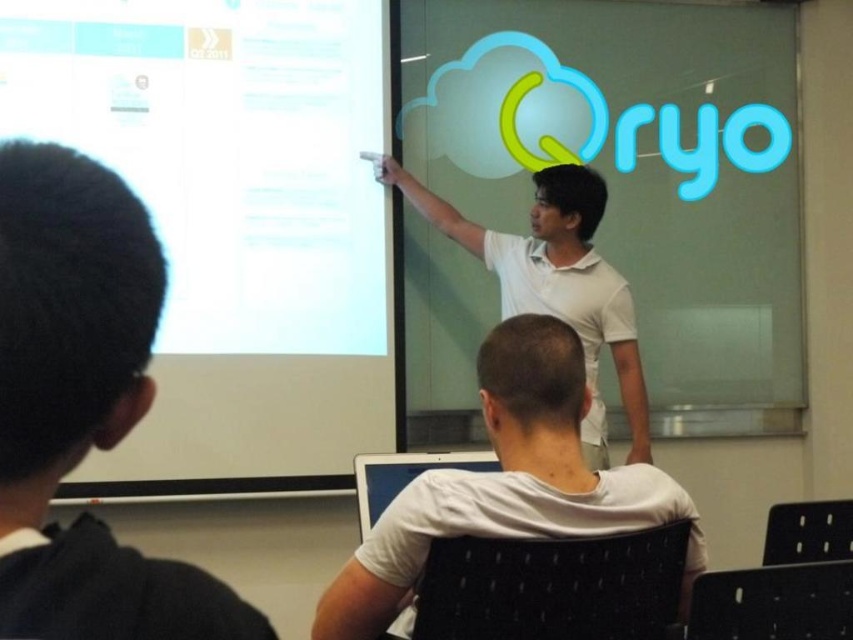
You are a photographer in the classroom and want to capture a photo where both the black hair at left and the white matte shirt at upper center are clearly visible. Given their sizes, which object should you focus on first to ensure both are in frame?

Since the black hair at left occupies less space than the white matte shirt at upper center, you should focus on the black hair at left first to ensure it is in frame, as it is smaller and might be harder to capture clearly.

You are sitting in the classroom and see two points marked on the wall. The first point is at coordinates point (206, 250) and the second is at point (782, 136). If you want to touch both points starting from your seat, which point should you reach first?

You should reach point (206, 250) first because it is in front of point (782, 136), so it is closer to you.